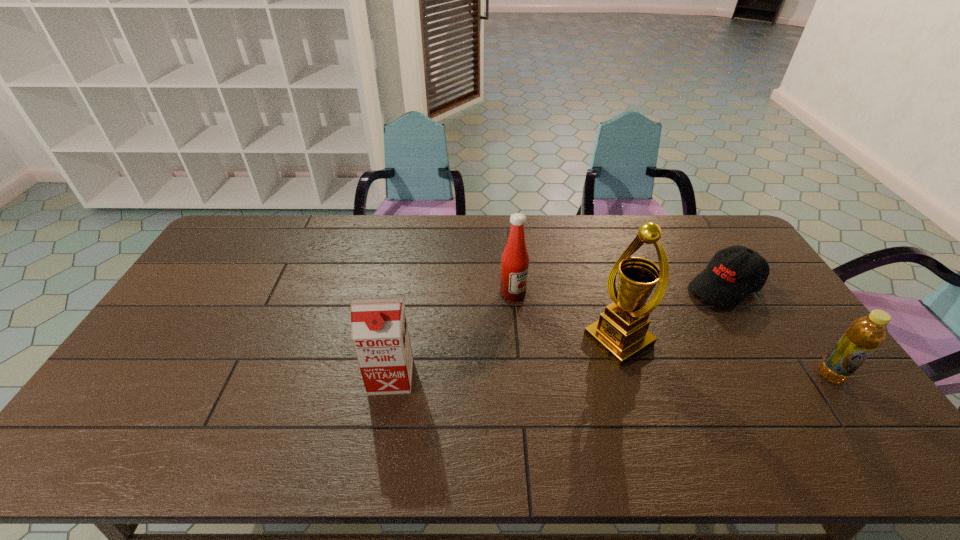
At what (x,y) coordinates should I click in order to perform the action: click on vacant space at the far edge of the desktop. Please return your answer as a coordinate pair (x, y). This screenshot has height=540, width=960. Looking at the image, I should click on (340, 230).

The height and width of the screenshot is (540, 960). In the image, there is a desktop. What are the coordinates of `vacant area at the left edge` in the screenshot? It's located at (231, 255).

In the image, there is a desktop. Where is `free space at the far left corner`? free space at the far left corner is located at coordinates (216, 254).

Where is `vacant point at the near right corner`? Image resolution: width=960 pixels, height=540 pixels. vacant point at the near right corner is located at coordinates (830, 403).

The width and height of the screenshot is (960, 540). In order to click on unoccupied area between the condiment and the tallest object in this screenshot , I will do [x=565, y=316].

Locate an element on the screen. vacant space that is in between the fourth object from right to left and the soya milk is located at coordinates (452, 335).

The width and height of the screenshot is (960, 540). Identify the location of vacant area that lies between the second shortest object and the baseball cap. (778, 331).

Where is `unoccupied area between the second shortest object and the baseball cap`? unoccupied area between the second shortest object and the baseball cap is located at coordinates (778, 331).

The height and width of the screenshot is (540, 960). In order to click on vacant space that is in between the condiment and the bottle in this screenshot , I will do `click(672, 334)`.

Find the location of a particular element. Image resolution: width=960 pixels, height=540 pixels. free point between the third object from right to left and the fourth object from right to left is located at coordinates (565, 316).